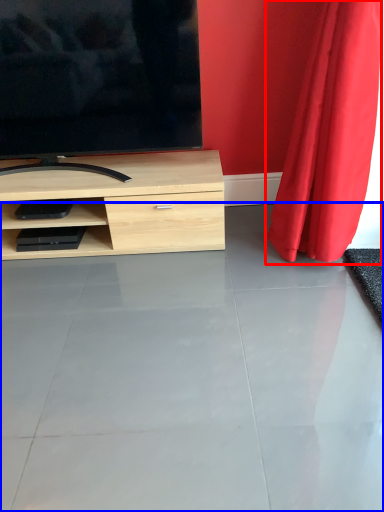
Question: Which object appears farthest to the camera in this image, curtain (highlighted by a red box) or concrete (highlighted by a blue box)?

Choices:
 (A) curtain
 (B) concrete

Answer: (A)